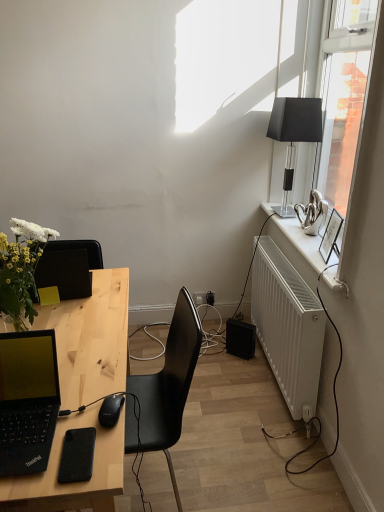
You are a GUI agent. You are given a task and a screenshot of the screen. Output one action in this format:
    pyautogui.click(x=<x>, y=<y>)
    Task: Click on the free point above white matte radiator at right (from a real-world perspective)
    This screenshot has width=384, height=512.
    Given the screenshot: What is the action you would take?
    pyautogui.click(x=296, y=269)